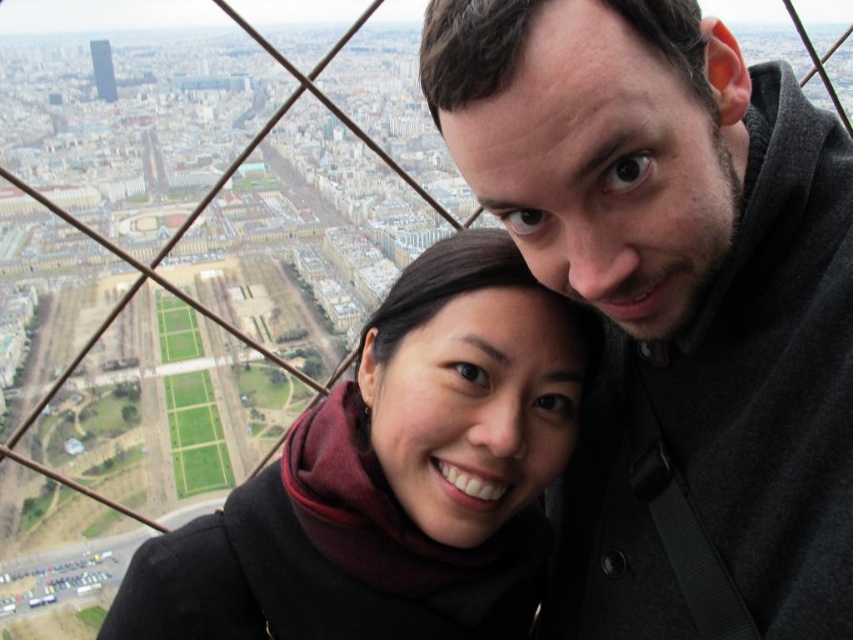
Question: Can you confirm if dark gray sweater at upper right is thinner than black wool scarf at center?

Choices:
 (A) no
 (B) yes

Answer: (B)

Question: Is dark gray sweater at upper right above black wool scarf at center?

Choices:
 (A) no
 (B) yes

Answer: (B)

Question: Which point appears farthest from the camera in this image?

Choices:
 (A) (781, 534)
 (B) (532, 397)

Answer: (B)

Question: Can you confirm if dark gray sweater at upper right is smaller than black wool scarf at center?

Choices:
 (A) yes
 (B) no

Answer: (B)

Question: Among these points, which one is nearest to the camera?

Choices:
 (A) tap(825, 605)
 (B) tap(219, 611)

Answer: (A)